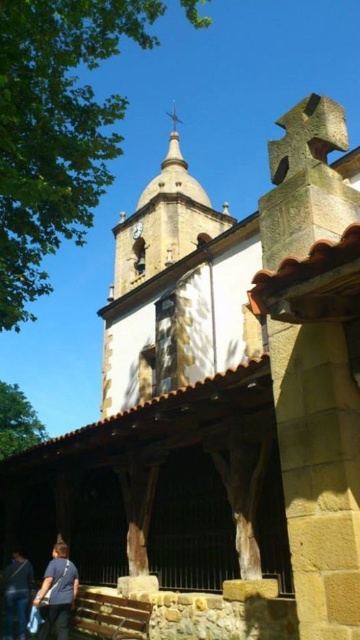
Question: Does blue cotton shirt at lower left appear on the left side of blue denim jeans at lower left?

Choices:
 (A) no
 (B) yes

Answer: (A)

Question: Which point is closer to the camera taking this photo?

Choices:
 (A) (3, 586)
 (B) (172, 234)

Answer: (A)

Question: Which point appears closest to the camera in this image?

Choices:
 (A) tap(138, 241)
 (B) tap(132, 230)
 (C) tap(46, 627)

Answer: (C)

Question: Does blue denim jeans at lower left appear under white glossy clock at upper center?

Choices:
 (A) no
 (B) yes

Answer: (B)

Question: Estimate the real-world distances between objects in this image. Which object is closer to the white glossy clock at upper center?

Choices:
 (A) smooth beige steeple at upper center
 (B) blue cotton shirt at lower left
 (C) blue denim jeans at lower left

Answer: (A)

Question: Does blue cotton shirt at lower left have a larger size compared to blue denim jeans at lower left?

Choices:
 (A) yes
 (B) no

Answer: (A)